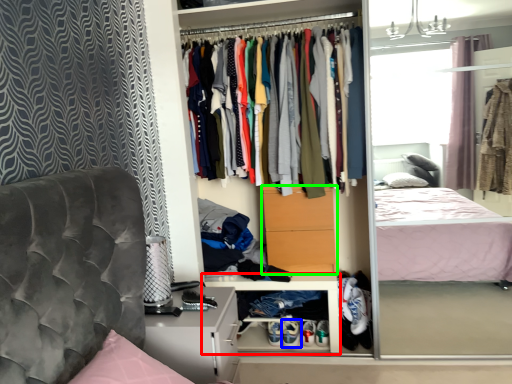
Question: Based on their relative distances, which object is nearer to cabinet (highlighted by a red box)? Choose from footwear (highlighted by a blue box) and drawer (highlighted by a green box).

Choices:
 (A) footwear
 (B) drawer

Answer: (B)